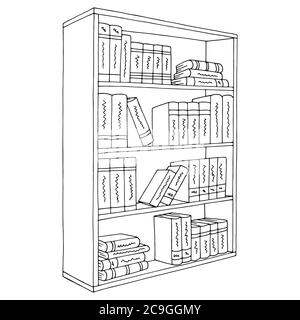
Image resolution: width=300 pixels, height=320 pixels. I want to click on books on top shelf, so click(104, 63), click(114, 67), click(123, 71), click(132, 67), click(149, 68), click(157, 72), click(164, 74), click(198, 63), click(199, 72), click(200, 81).